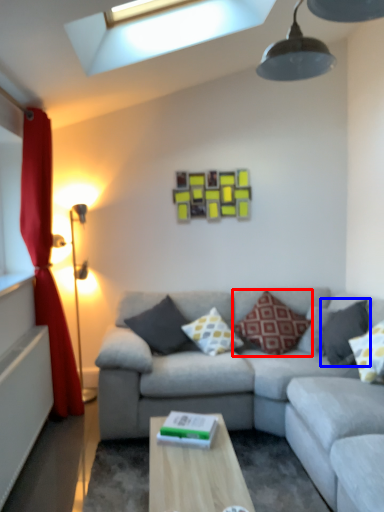
Question: Which point is further to the camera, pillow (highlighted by a red box) or pillow (highlighted by a blue box)?

Choices:
 (A) pillow
 (B) pillow

Answer: (A)